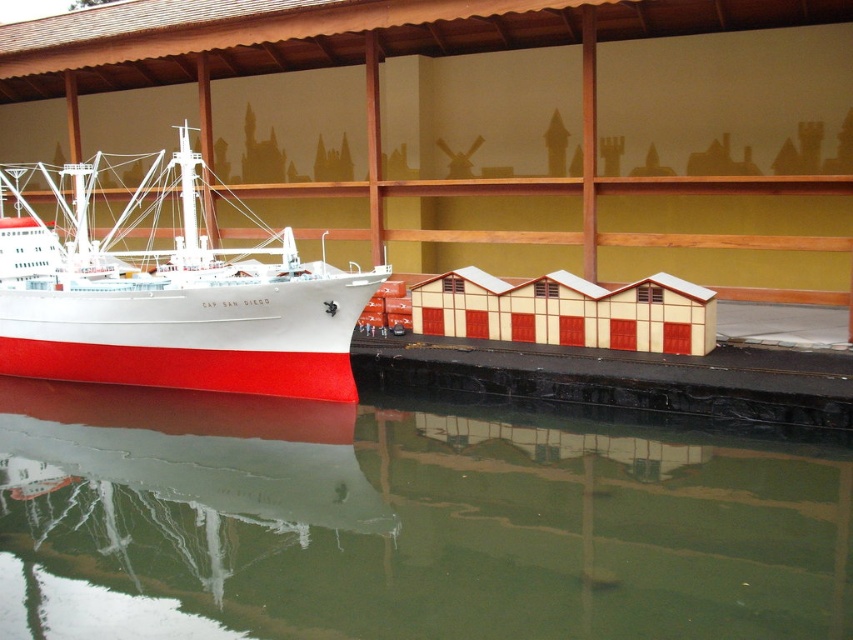
Looking at this image, you are a model ship enthusiast standing at the edge of the dockside structure to the right. You want to place a small flag on the green reflective water at lower center. According to the coordinates provided, where should you place the flag?

The green reflective water at lower center should have the flag placed at coordinates point (x=401, y=524) as specified in the description.

You are a delivery drone that needs to land on the black rubber dock at lower center. The minimum safe distance required for landing is 10 meters. Can you safely land on the dock if you are currently positioned at the white matte ship at left?

The white matte ship at left is 9.08 meters away from the black rubber dock at lower center. Since the minimum safe distance required for landing is 10 meters, the drone cannot safely land on the dock from its current position.